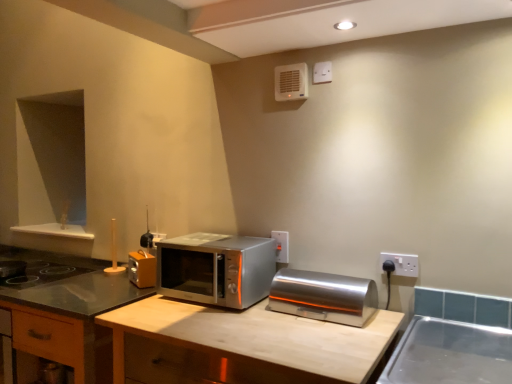
Where is `free space in front of satin silver microwave at center`? The image size is (512, 384). free space in front of satin silver microwave at center is located at coordinates (203, 319).